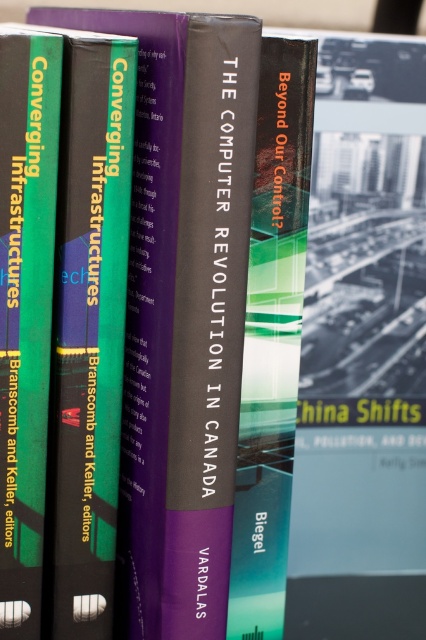
Question: Which object appears closest to the camera in this image?

Choices:
 (A) green matte book at center
 (B) green matte book at left

Answer: (B)

Question: Does hardcover book at center appear on the left side of green matte book at left?

Choices:
 (A) no
 (B) yes

Answer: (A)

Question: Which point is farther to the camera?

Choices:
 (A) (121, 150)
 (B) (282, 72)
 (C) (23, 312)

Answer: (B)

Question: Observing the image, what is the correct spatial positioning of green matte book at center in reference to green matte book at left?

Choices:
 (A) above
 (B) below

Answer: (B)

Question: From the image, what is the correct spatial relationship of green matte book at center in relation to green matte book at left?

Choices:
 (A) left
 (B) right

Answer: (B)

Question: Which object is farther from the camera taking this photo?

Choices:
 (A) green matte book at center
 (B) hardcover book at center
 (C) green matte book at left

Answer: (B)